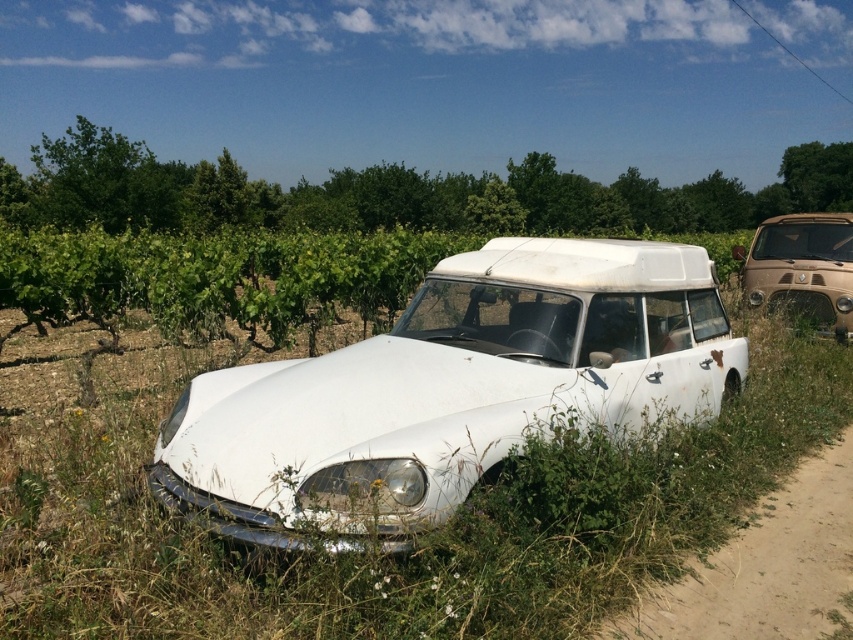
Is point (693, 404) closer to camera compared to point (796, 275)?

Yes, point (693, 404) is closer to viewer.

Does white matte car at center have a lesser height compared to brown matte van at right?

Yes.

The height and width of the screenshot is (640, 853). What do you see at coordinates (448, 390) in the screenshot? I see `white matte car at center` at bounding box center [448, 390].

I want to click on white matte car at center, so click(448, 390).

Does white matte car at center have a larger size compared to dirt track at lower right?

Yes.

Does white matte car at center have a greater height compared to dirt track at lower right?

Correct, white matte car at center is much taller as dirt track at lower right.

In order to click on white matte car at center in this screenshot , I will do `click(448, 390)`.

Is dirt track at lower right positioned before brown matte van at right?

Yes, dirt track at lower right is in front of brown matte van at right.

Does dirt track at lower right have a greater height compared to brown matte van at right?

No.

This screenshot has width=853, height=640. Identify the location of dirt track at lower right. (764, 566).